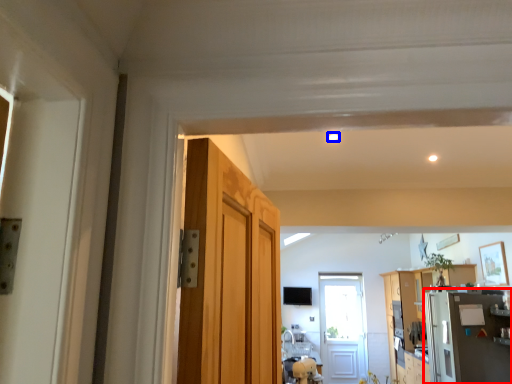
Question: Which object appears farthest to the camera in this image, appliance (highlighted by a red box) or light (highlighted by a blue box)?

Choices:
 (A) appliance
 (B) light

Answer: (A)